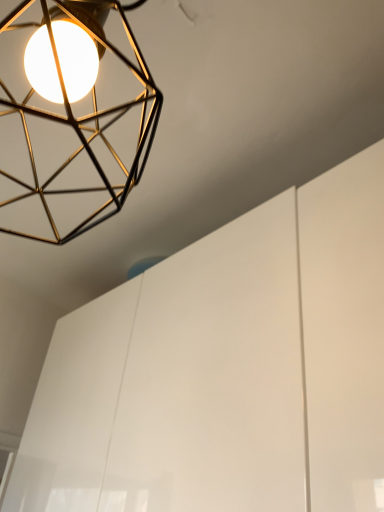
Question: From the image's perspective, relative to gold wireframe lamp at upper left, is white glossy cabinet at upper center above or below?

Choices:
 (A) above
 (B) below

Answer: (B)

Question: Based on their positions, is white glossy cabinet at upper center located to the left or right of gold wireframe lamp at upper left?

Choices:
 (A) left
 (B) right

Answer: (B)

Question: Looking at their shapes, would you say white glossy cabinet at upper center is wider or thinner than gold wireframe lamp at upper left?

Choices:
 (A) wide
 (B) thin

Answer: (A)

Question: Is gold wireframe lamp at upper left in front of or behind white glossy cabinet at upper center in the image?

Choices:
 (A) behind
 (B) front

Answer: (B)

Question: In terms of size, does gold wireframe lamp at upper left appear bigger or smaller than white glossy cabinet at upper center?

Choices:
 (A) small
 (B) big

Answer: (A)

Question: Considering the relative positions of gold wireframe lamp at upper left and white glossy cabinet at upper center in the image provided, is gold wireframe lamp at upper left to the left or to the right of white glossy cabinet at upper center?

Choices:
 (A) left
 (B) right

Answer: (A)

Question: Would you say gold wireframe lamp at upper left is inside or outside white glossy cabinet at upper center?

Choices:
 (A) outside
 (B) inside

Answer: (A)